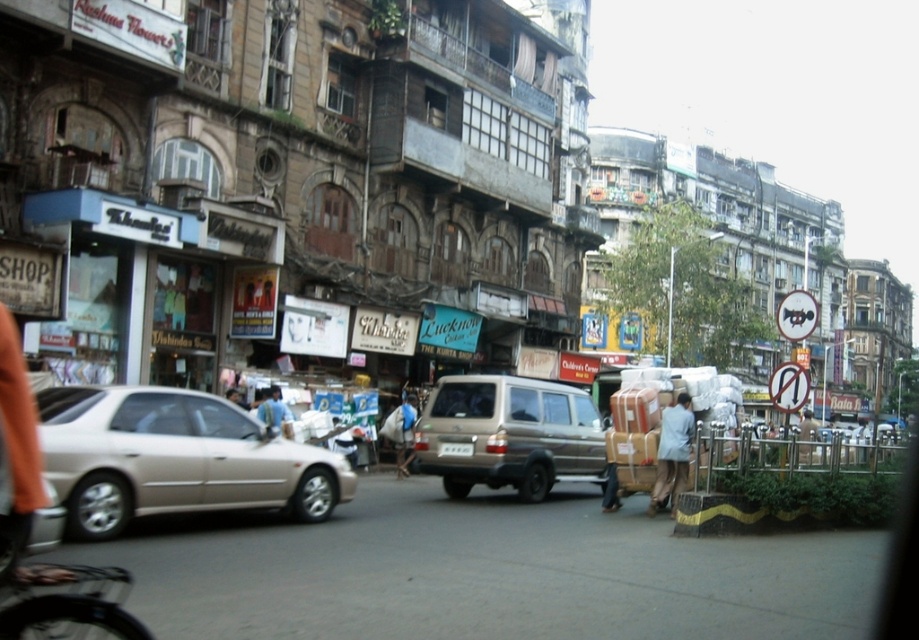
Is gold metallic van at center smaller than light brown fabric jacket at lower right?

Yes.

Who is more forward, (469, 397) or (661, 426)?

Point (661, 426) is more forward.

I want to click on gold metallic van at center, so click(x=508, y=435).

Is light brown fabric jacket at lower right positioned behind light blue shirt at center?

Yes, light brown fabric jacket at lower right is behind light blue shirt at center.

Who is shorter, light brown fabric jacket at lower right or light blue shirt at center?

light brown fabric jacket at lower right

Where is `light brown fabric jacket at lower right`? light brown fabric jacket at lower right is located at coordinates (672, 452).

Which is more to the right, gold metallic van at center or light blue shirt at center?

Positioned to the right is light blue shirt at center.

Is point (449, 404) less distant than point (800, 424)?

Yes, it is.

Is point (541, 442) behind point (800, 445)?

Yes, point (541, 442) is farther from viewer.

Identify the location of gold metallic van at center. This screenshot has height=640, width=919. (508, 435).